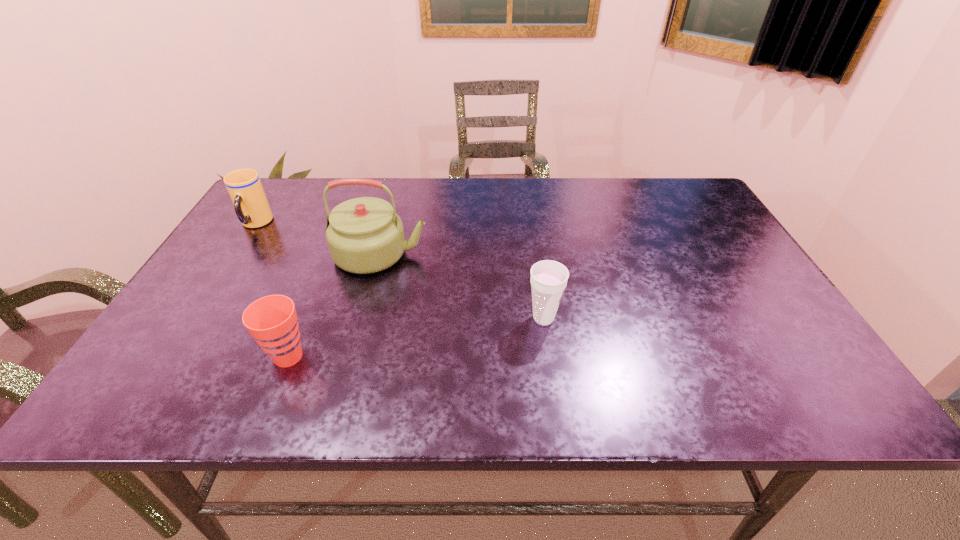
Find the location of a particular element. vacant area that lies between the leftmost object and the nearest object is located at coordinates (272, 291).

What are the coordinates of `free spot between the nearest cup and the farthest cup` in the screenshot? It's located at pos(272,291).

The height and width of the screenshot is (540, 960). What are the coordinates of `free space between the second cup from right to left and the second nearest cup` in the screenshot? It's located at (416, 338).

You are a GUI agent. You are given a task and a screenshot of the screen. Output one action in this format:
    pyautogui.click(x=<x>, y=<y>)
    Task: Click on the free spot between the second nearest object and the nearest object
    This screenshot has height=540, width=960.
    Given the screenshot: What is the action you would take?
    pyautogui.click(x=416, y=338)

Locate an element on the screen. The width and height of the screenshot is (960, 540). empty space between the leftmost cup and the nearest object is located at coordinates (272, 291).

Locate an element on the screen. Image resolution: width=960 pixels, height=540 pixels. free space that is in between the nearest object and the tallest object is located at coordinates (335, 306).

Find the location of a particular element. This screenshot has width=960, height=540. unoccupied area between the second nearest object and the nearest object is located at coordinates (416, 338).

The image size is (960, 540). What are the coordinates of `vacant space in between the farthest cup and the tallest object` in the screenshot? It's located at (318, 239).

This screenshot has height=540, width=960. Identify the location of free space between the leftmost cup and the tallest object. (318, 239).

Find the location of a particular element. The width and height of the screenshot is (960, 540). free space between the leftmost object and the second farthest cup is located at coordinates (399, 271).